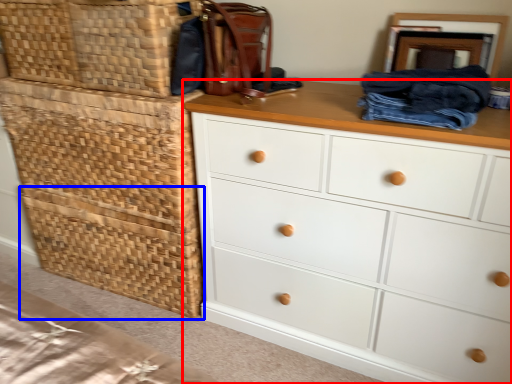
Question: Which object is further to the camera taking this photo, chest of drawers (highlighted by a red box) or basket (highlighted by a blue box)?

Choices:
 (A) chest of drawers
 (B) basket

Answer: (B)